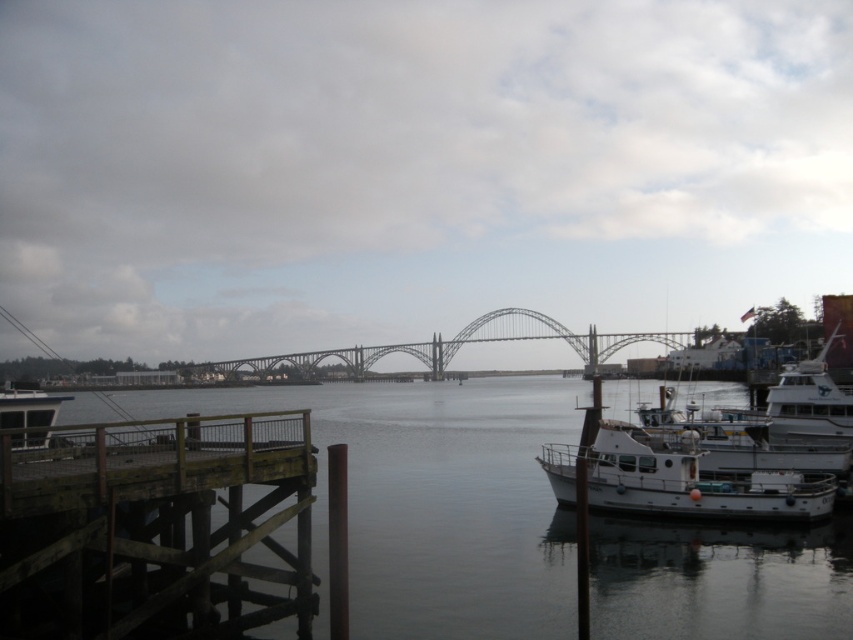
Does brown wooden dock at lower left appear under white glossy boat at left?

Incorrect, brown wooden dock at lower left is not positioned below white glossy boat at left.

Does brown wooden dock at lower left have a larger size compared to white glossy boat at left?

Incorrect, brown wooden dock at lower left is not larger than white glossy boat at left.

Is point (100, 436) positioned after point (3, 424)?

No, it is in front of (3, 424).

Find the location of a particular element. brown wooden dock at lower left is located at coordinates (152, 525).

Can you confirm if smooth gray water at center is positioned below brown wooden dock at lower left?

Correct, smooth gray water at center is located below brown wooden dock at lower left.

Does smooth gray water at center have a lesser width compared to brown wooden dock at lower left?

In fact, smooth gray water at center might be wider than brown wooden dock at lower left.

Which is in front, point (560, 412) or point (9, 436)?

Point (9, 436) is more forward.

Locate an element on the screen. The height and width of the screenshot is (640, 853). smooth gray water at center is located at coordinates (433, 499).

Is smooth gray water at center to the left of white glossy boat at left from the viewer's perspective?

Incorrect, smooth gray water at center is not on the left side of white glossy boat at left.

Who is more forward, (635, 536) or (45, 394)?

Point (635, 536)

Identify the location of smooth gray water at center. (433, 499).